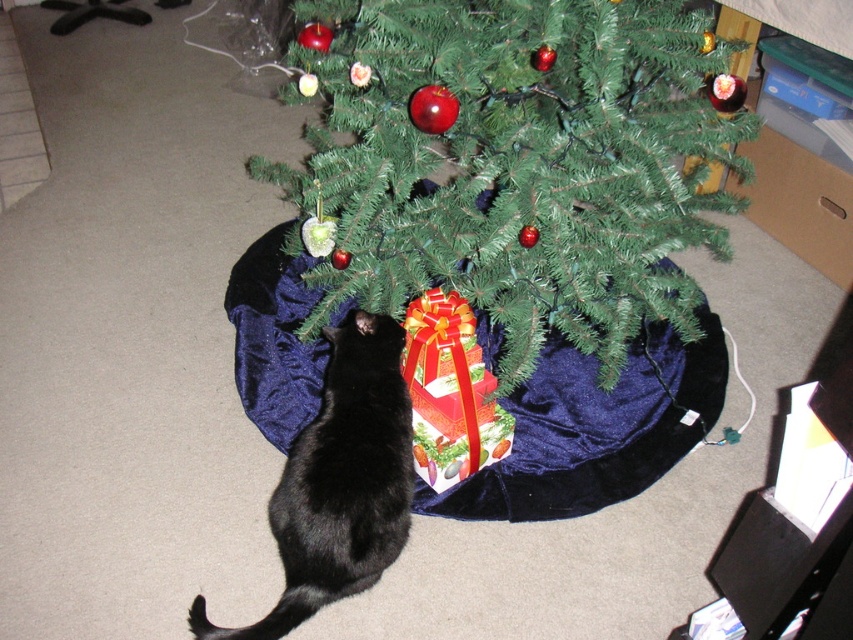
Is green matte christmas tree at center thinner than black fur cat at lower center?

No, green matte christmas tree at center is not thinner than black fur cat at lower center.

Who is lower down, green matte christmas tree at center or black fur cat at lower center?

Positioned lower is black fur cat at lower center.

Does point (407, 0) come closer to viewer compared to point (370, 394)?

That is True.

Locate an element on the screen. green matte christmas tree at center is located at coordinates (517, 164).

Does green matte christmas tree at center have a smaller size compared to shiny paper gift at under tree?

Incorrect, green matte christmas tree at center is not smaller in size than shiny paper gift at under tree.

Between green matte christmas tree at center and shiny paper gift at under tree, which one is positioned higher?

green matte christmas tree at center is higher up.

Between point (656, 88) and point (445, 464), which one is positioned behind?

The point (445, 464) is behind.

I want to click on green matte christmas tree at center, so click(517, 164).

Is point (317, 460) closer to viewer compared to point (445, 294)?

That is True.

Can you confirm if black fur cat at lower center is positioned above shiny paper gift at under tree?

Incorrect, black fur cat at lower center is not positioned above shiny paper gift at under tree.

Between point (376, 332) and point (427, 291), which one is positioned in front?

Positioned in front is point (376, 332).

Where is `black fur cat at lower center`? black fur cat at lower center is located at coordinates (339, 483).